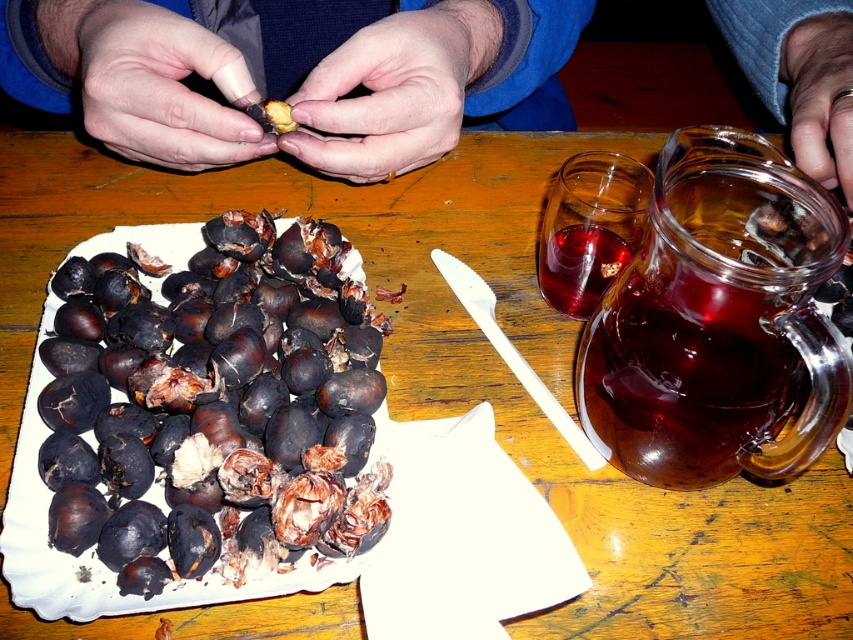
Question: Does transparent glass at upper right appear on the left side of translucent glass mug at upper right?

Choices:
 (A) yes
 (B) no

Answer: (B)

Question: Does smooth brown chestnut at center have a greater width compared to translucent glass mug at upper right?

Choices:
 (A) yes
 (B) no

Answer: (A)

Question: Which of these objects is positioned farthest from the transparent glass jar at upper right?

Choices:
 (A) smooth brown chestnut at center
 (B) brown matte chestnut at center
 (C) translucent glass mug at upper right
 (D) transparent glass at upper right

Answer: (B)

Question: Which object is farther from the camera taking this photo?

Choices:
 (A) brown matte chestnut at center
 (B) smooth brown chestnut at center

Answer: (A)

Question: Which of these objects is positioned farthest from the black matte chestnuts at lower left?

Choices:
 (A) transparent glass at upper right
 (B) brown matte chestnut at center
 (C) translucent glass mug at upper right
 (D) transparent glass jar at upper right

Answer: (C)

Question: Does smooth brown chestnut at center have a smaller size compared to translucent glass mug at upper right?

Choices:
 (A) no
 (B) yes

Answer: (A)